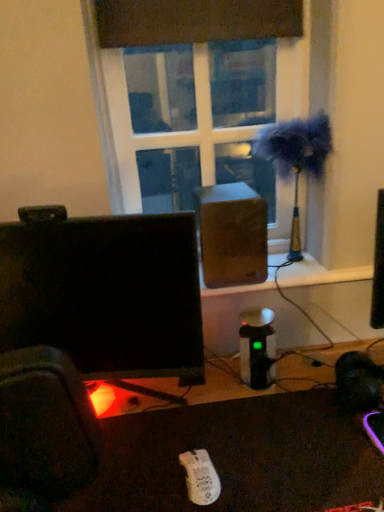
Question: Does white matte wii controller at lower center turn towards wooden speaker at center?

Choices:
 (A) no
 (B) yes

Answer: (A)

Question: Are white matte wii controller at lower center and wooden speaker at center located far from each other?

Choices:
 (A) no
 (B) yes

Answer: (A)

Question: Is white matte wii controller at lower center turned away from wooden speaker at center?

Choices:
 (A) yes
 (B) no

Answer: (B)

Question: Considering the relative sizes of white matte wii controller at lower center and wooden speaker at center in the image provided, is white matte wii controller at lower center smaller than wooden speaker at center?

Choices:
 (A) yes
 (B) no

Answer: (A)

Question: Considering the relative positions of white matte wii controller at lower center and wooden speaker at center in the image provided, is white matte wii controller at lower center in front of wooden speaker at center?

Choices:
 (A) no
 (B) yes

Answer: (B)

Question: Is white matte wii controller at lower center not within wooden speaker at center?

Choices:
 (A) no
 (B) yes

Answer: (B)

Question: Considering the relative sizes of transparent glass window at center and black glossy monitor at center in the image provided, is transparent glass window at center smaller than black glossy monitor at center?

Choices:
 (A) no
 (B) yes

Answer: (B)

Question: From a real-world perspective, does transparent glass window at center stand above black glossy monitor at center?

Choices:
 (A) yes
 (B) no

Answer: (A)

Question: Does transparent glass window at center turn towards black glossy monitor at center?

Choices:
 (A) yes
 (B) no

Answer: (A)

Question: Can you confirm if transparent glass window at center is positioned to the right of black glossy monitor at center?

Choices:
 (A) no
 (B) yes

Answer: (B)

Question: From the image's perspective, does transparent glass window at center appear lower than black glossy monitor at center?

Choices:
 (A) yes
 (B) no

Answer: (B)

Question: Considering the relative positions of transparent glass window at center and black glossy monitor at center in the image provided, is transparent glass window at center to the left of black glossy monitor at center from the viewer's perspective?

Choices:
 (A) yes
 (B) no

Answer: (B)

Question: Is white matte wii controller at lower center completely or partially inside metallic gold table lamp at upper right?

Choices:
 (A) no
 (B) yes

Answer: (A)